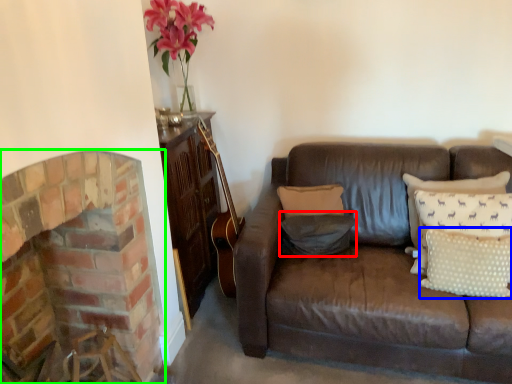
Question: Considering the real-world distances, which object is farthest from pillow (highlighted by a red box)? pillow (highlighted by a blue box) or fireplace (highlighted by a green box)?

Choices:
 (A) pillow
 (B) fireplace

Answer: (B)